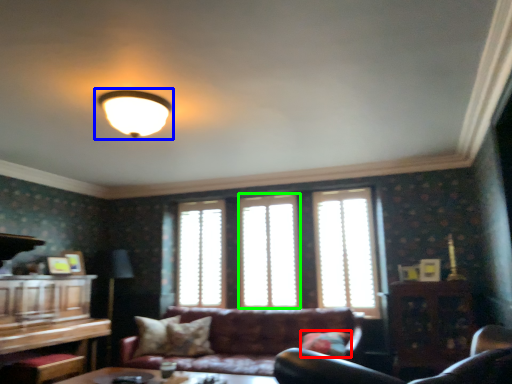
Question: Which is farther away from pillow (highlighted by a red box)? lamp (highlighted by a blue box) or window (highlighted by a green box)?

Choices:
 (A) lamp
 (B) window

Answer: (A)